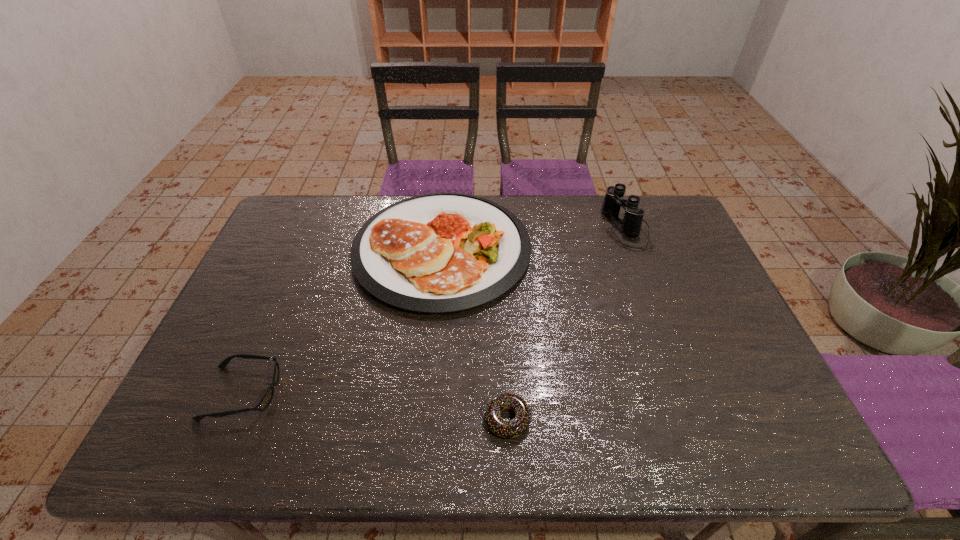
I want to click on the rightmost object, so click(x=631, y=224).

Identify the location of the tallest object. This screenshot has width=960, height=540. (631, 224).

What are the coordinates of `the second tallest object` in the screenshot? It's located at (437, 253).

This screenshot has height=540, width=960. I want to click on the second shortest object, so click(x=268, y=396).

Where is `the leftmost object`? Image resolution: width=960 pixels, height=540 pixels. the leftmost object is located at coordinates (268, 396).

Find the location of a particular element. The height and width of the screenshot is (540, 960). the shortest object is located at coordinates (507, 429).

Identify the location of vacant space situated on the right of the binoculars. (670, 227).

What are the coordinates of `blank space located 0.110m on the left of the second tallest object` in the screenshot? It's located at (319, 249).

Where is `free space located on the front-facing side of the second shortest object`? free space located on the front-facing side of the second shortest object is located at coordinates (364, 393).

At what (x,y) coordinates should I click in order to perform the action: click on free space located on the left of the shortest object. Please return your answer as a coordinate pair (x, y). The height and width of the screenshot is (540, 960). Looking at the image, I should click on (378, 419).